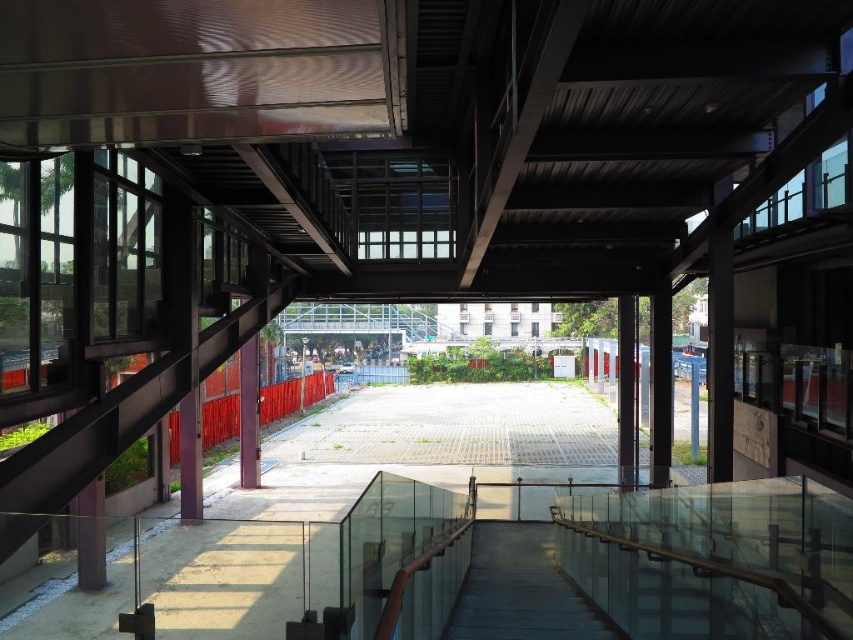
Is transparent glass walkway at center positioned behind smooth concrete stairs at center?

No, it is in front of smooth concrete stairs at center.

Measure the distance between transparent glass walkway at center and camera.

10.10 feet

The image size is (853, 640). Find the location of `transparent glass walkway at center`. transparent glass walkway at center is located at coordinates (303, 518).